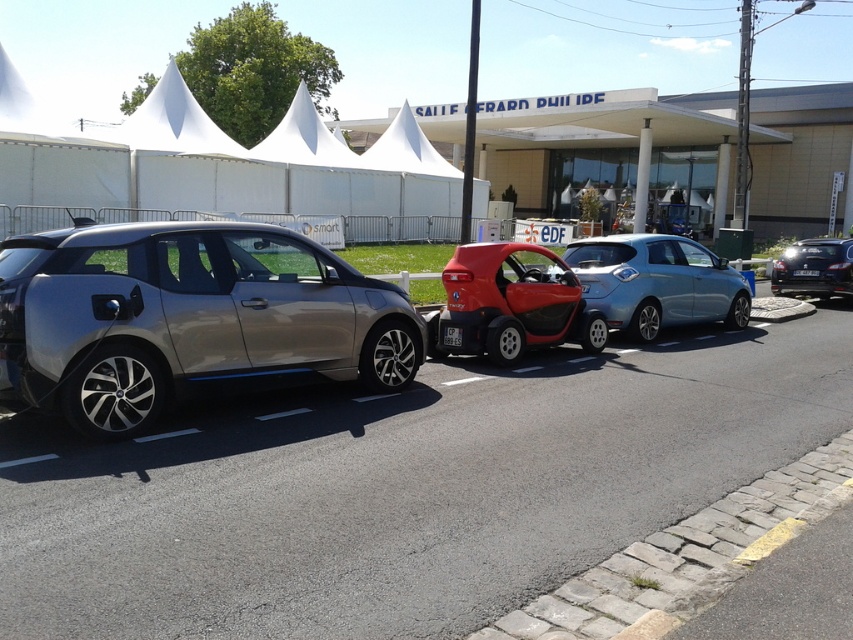
You are a delivery person who needs to load a package onto the roof of the satin silver car at center. The package is 1.2 meters tall. Can you safely place it there without hitting the metallic blue sedan at right?

The satin silver car at center is not as tall as the metallic blue sedan at right. Since the package is 1.2 meters tall, you need to ensure there is enough vertical clearance between the satin silver car at center and the metallic blue sedan at right. However, the description does not provide information about the distance between the two cars or the height of the metallic blue sedan. Therefore, it is uncertain if the package can be safely placed on the roof without hitting the sedan.

You are a delivery person with a cart that is 2 meters wide. You need to move between the satin silver car at center and the shiny red car at center to deliver a package. Can your cart fit through the space between them?

The satin silver car at center and shiny red car at center are 2.55 meters apart from each other. Since your cart is 2 meters wide, it can fit through the space between them as the distance is greater than the cart width.